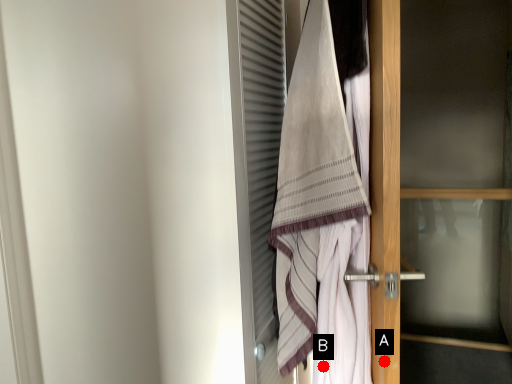
Question: Two points are circled on the image, labeled by A and B beside each circle. Which point is farther to the camera?

Choices:
 (A) A is further
 (B) B is further

Answer: (B)